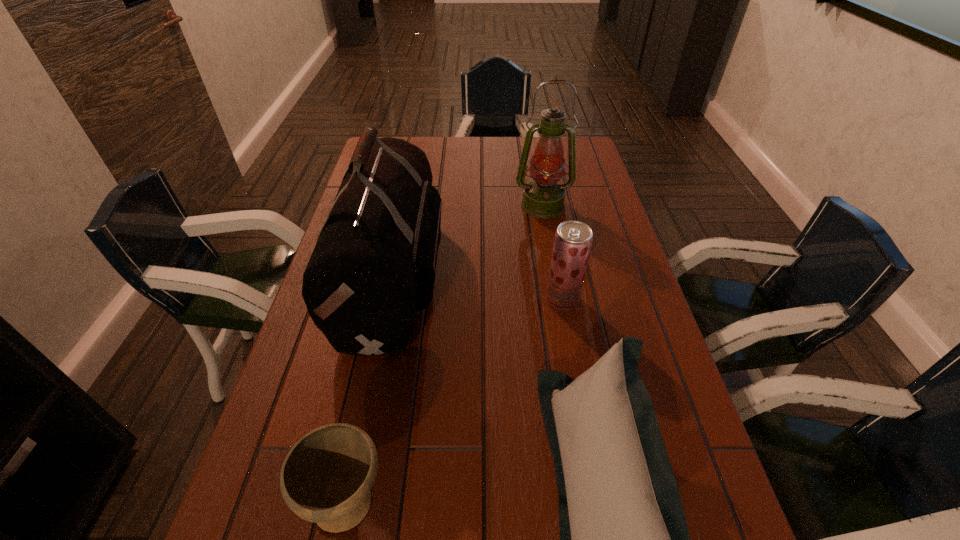
Where is `free space between the duffel bag and the third shortest object`? free space between the duffel bag and the third shortest object is located at coordinates (478, 288).

Locate an element on the screen. Image resolution: width=960 pixels, height=540 pixels. vacant area that lies between the oil lamp and the duffel bag is located at coordinates (468, 240).

Find the location of `vacant area between the duffel bag and the fruit juice`. vacant area between the duffel bag and the fruit juice is located at coordinates (478, 288).

In order to click on the third closest object to the shortest object in this screenshot , I will do pos(573,239).

Where is `object that can be found as the third closest to the oil lamp`? The width and height of the screenshot is (960, 540). object that can be found as the third closest to the oil lamp is located at coordinates (624, 539).

Where is `free spot that satisfies the following two spatial constraints: 1. on the front pocket of the duffel bag; 2. on the left side of the fruit juice`? The image size is (960, 540). free spot that satisfies the following two spatial constraints: 1. on the front pocket of the duffel bag; 2. on the left side of the fruit juice is located at coordinates (389, 300).

At what (x,y) coordinates should I click in order to perform the action: click on free spot that satisfies the following two spatial constraints: 1. on the front side of the oil lamp; 2. on the front pocket of the duffel bag. Please return your answer as a coordinate pair (x, y). Looking at the image, I should click on (555, 275).

Where is `free location that satisfies the following two spatial constraints: 1. on the front pocket of the third shortest object; 2. on the right side of the duffel bag`? This screenshot has height=540, width=960. free location that satisfies the following two spatial constraints: 1. on the front pocket of the third shortest object; 2. on the right side of the duffel bag is located at coordinates pyautogui.click(x=389, y=300).